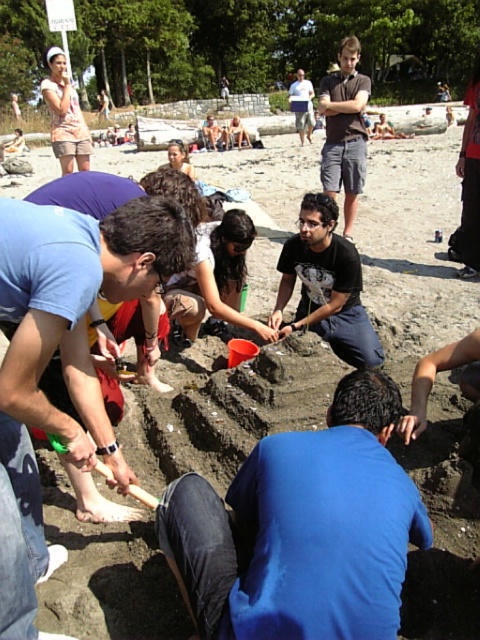
Question: Does dark gray shorts at center lie in front of dark gray t-shirt at upper center?

Choices:
 (A) no
 (B) yes

Answer: (B)

Question: Is blue matte shirt at center further to camera compared to smooth brown sand at center?

Choices:
 (A) yes
 (B) no

Answer: (B)

Question: Does blue matte shirt at center lie in front of black matte shirt at center?

Choices:
 (A) yes
 (B) no

Answer: (A)

Question: Considering the real-world distances, which object is closest to the dark gray t-shirt at upper center?

Choices:
 (A) black matte shirt at center
 (B) dark gray shorts at center

Answer: (B)

Question: Which of these objects is positioned farthest from the dark gray shorts at center?

Choices:
 (A) dark gray t-shirt at upper center
 (B) black matte shirt at center

Answer: (A)

Question: Which point is farther from the camera taking this photo?

Choices:
 (A) (323, 308)
 (B) (178, 314)
 (C) (112, 442)

Answer: (A)